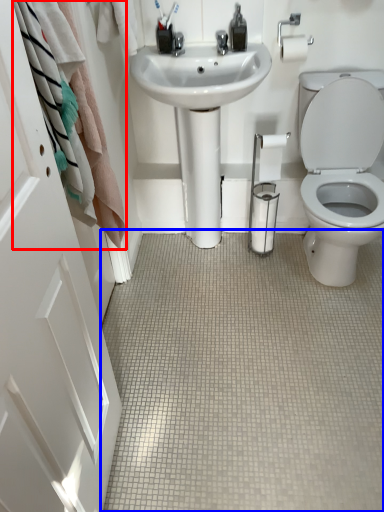
Question: Which point is closer to the camera, bath towel (highlighted by a red box) or plain (highlighted by a blue box)?

Choices:
 (A) bath towel
 (B) plain

Answer: (A)